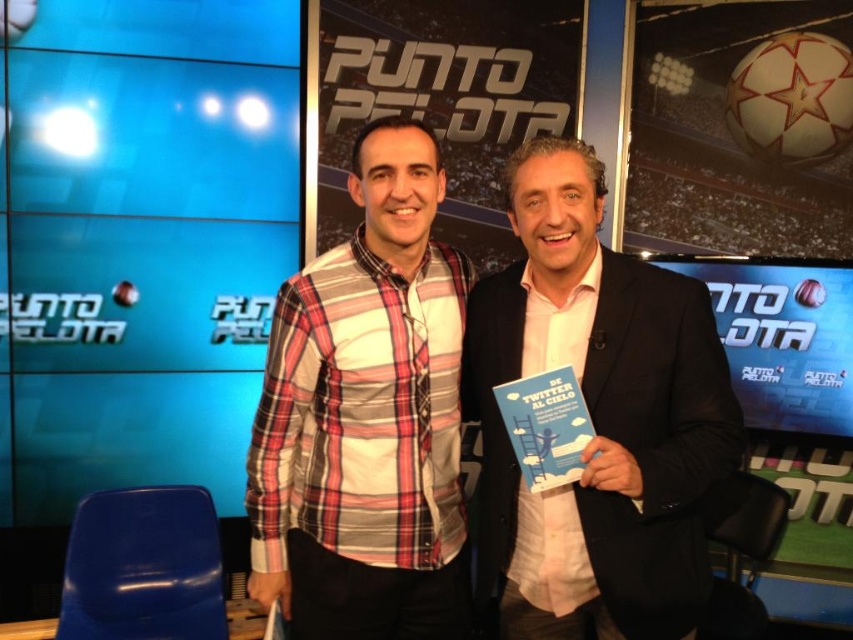
Can you confirm if matte black suit at center is thinner than plaid cotton shirt at center?

No.

From the picture: Is matte black suit at center below plaid cotton shirt at center?

Yes, matte black suit at center is below plaid cotton shirt at center.

Between point (524, 173) and point (323, 524), which one is positioned in front?

Point (524, 173) is in front.

Identify the location of matte black suit at center. (595, 419).